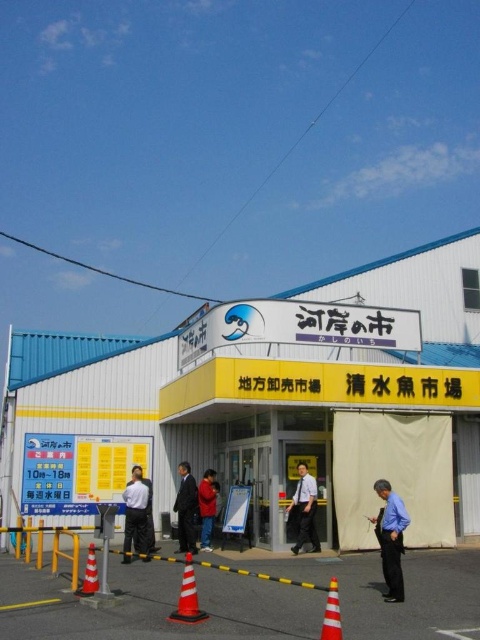
You are a delivery person standing at the entrance of the commercial building. You need to place a package on the orange matte traffic cone at lower center. However, you notice someone wearing a light blue shirt at center is standing nearby. Can you safely place the package on the cone without getting too close to the person?

The light blue shirt at center and orange matte traffic cone at lower center are 6.01 meters apart from each other. Since 6.01 meters is a safe distance, you can place the package on the orange matte traffic cone at lower center without getting too close to the person wearing the light blue shirt at center.

You are a delivery person standing at the entrance of the commercial building. You need to locate the dark gray suit at center and the orange matte traffic cone at lower center. Which object is positioned higher from the ground?

The orange matte traffic cone at lower center is positioned higher than the dark gray suit at center because the dark gray suit at center is located below it.